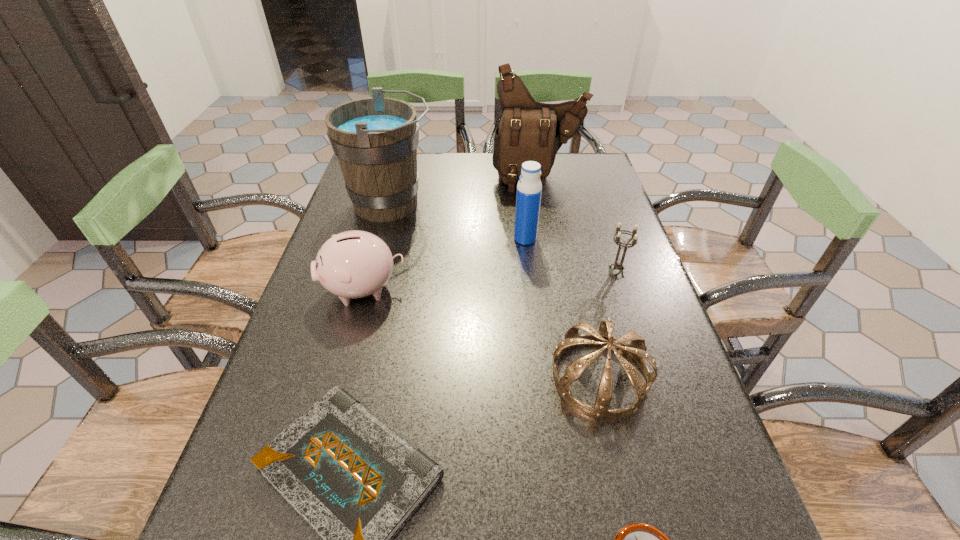
Identify the location of shoulder bag. This screenshot has height=540, width=960. (528, 130).

The image size is (960, 540). Identify the location of wine bucket. (375, 140).

Find the location of a particular element. the sixth nearest object is located at coordinates (529, 188).

In order to click on the sixth shortest object in this screenshot , I will do `click(529, 188)`.

The width and height of the screenshot is (960, 540). Find the location of `piggy bank`. piggy bank is located at coordinates (353, 264).

This screenshot has width=960, height=540. I want to click on candle holder, so click(x=618, y=266).

The width and height of the screenshot is (960, 540). What are the coordinates of `tiara` in the screenshot? It's located at (636, 349).

Identify the location of vacant space situated 0.220m on the front-facing side of the shoulder bag. The image size is (960, 540). (549, 238).

This screenshot has width=960, height=540. What are the coordinates of `vacant space located 0.180m with a handle on the side of the wine bucket` in the screenshot? It's located at (498, 204).

In order to click on blank space located on the left of the sixth nearest object in this screenshot , I will do `click(420, 239)`.